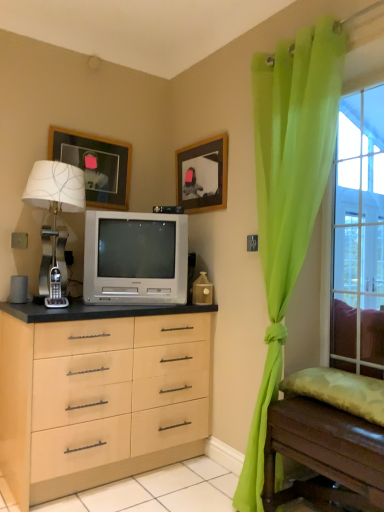
Question: In the image, is wooden picture frame at upper left, the first picture frame when ordered from left to right, positioned in front of or behind green sheer curtain at right?

Choices:
 (A) behind
 (B) front

Answer: (A)

Question: From a real-world perspective, relative to green sheer curtain at right, is wooden picture frame at upper left, the first picture frame when ordered from left to right, vertically above or below?

Choices:
 (A) below
 (B) above

Answer: (B)

Question: Which object is positioned farthest from the wooden picture frame at upper left, the first picture frame when ordered from left to right?

Choices:
 (A) clear glass window at right
 (B) wooden table at lower right
 (C) green sheer curtain at right
 (D) satin silver television at center
 (E) silver metallic table lamp at left

Answer: (A)

Question: Estimate the real-world distances between objects in this image. Which object is farther from the satin silver television at center?

Choices:
 (A) wooden table at lower right
 (B) green sheer curtain at right
 (C) wooden picture frame at upper center, which is the first picture frame in right-to-left order
 (D) wooden picture frame at upper left, arranged as the 2th picture frame when viewed from the right
 (E) clear glass window at right

Answer: (E)